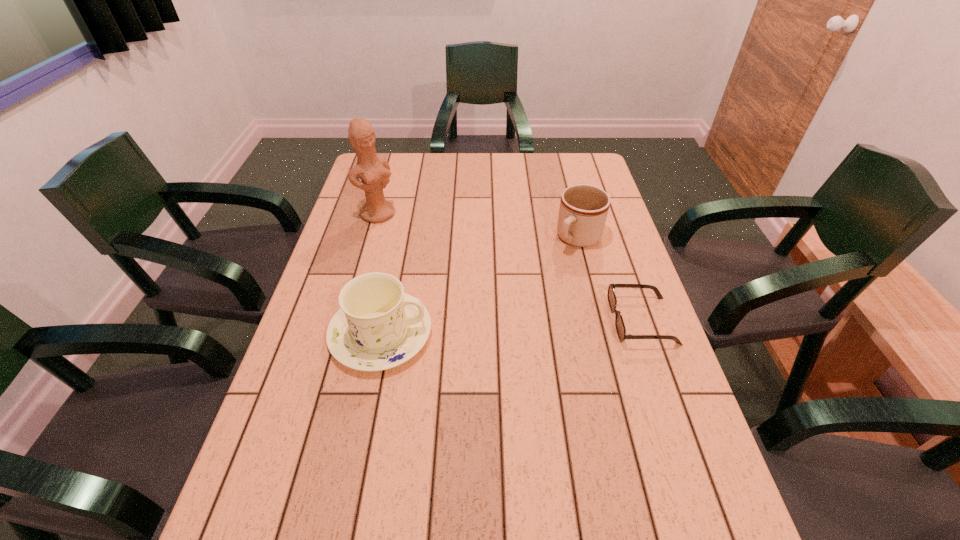
This screenshot has width=960, height=540. What are the coordinates of `free spot located on the side of the mug with the handle` in the screenshot? It's located at (524, 296).

Locate an element on the screen. This screenshot has height=540, width=960. vacant space located 0.380m on the front-facing side of the figurine is located at coordinates (456, 290).

Find the location of a particular element. The width and height of the screenshot is (960, 540). vacant region located on the front-facing side of the figurine is located at coordinates (402, 237).

You are a GUI agent. You are given a task and a screenshot of the screen. Output one action in this format:
    pyautogui.click(x=<x>, y=<y>)
    Task: Click on the vacant space located 0.380m on the front-facing side of the figurine
    This screenshot has height=540, width=960.
    Given the screenshot: What is the action you would take?
    pyautogui.click(x=456, y=290)

The height and width of the screenshot is (540, 960). What are the coordinates of `chinaware that is at the left edge` in the screenshot? It's located at [378, 326].

Find the location of `figurine that is at the left edge`. figurine that is at the left edge is located at coordinates (374, 172).

I want to click on sunglasses at the right edge, so click(x=619, y=323).

What are the coordinates of `mug positioned at the right edge` in the screenshot? It's located at (583, 210).

Where is `blank space at the far edge of the desktop`? Image resolution: width=960 pixels, height=540 pixels. blank space at the far edge of the desktop is located at coordinates (412, 173).

Identify the location of free space at the left edge of the desktop. (311, 375).